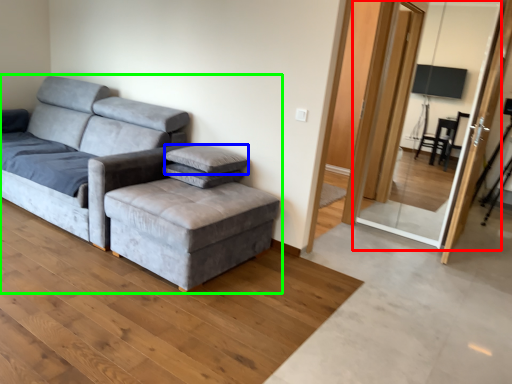
Question: Based on their relative distances, which object is farther from screen door (highlighted by a red box)? Choose from pillow (highlighted by a blue box) and studio couch (highlighted by a green box).

Choices:
 (A) pillow
 (B) studio couch

Answer: (B)